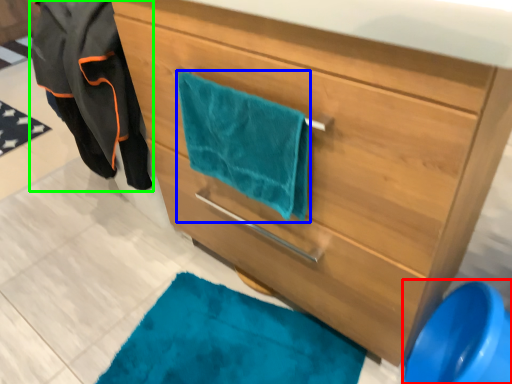
Question: Based on their relative distances, which object is farther from teal (highlighted by a red box)? Choose from beach towel (highlighted by a blue box) and jacket (highlighted by a green box).

Choices:
 (A) beach towel
 (B) jacket

Answer: (B)